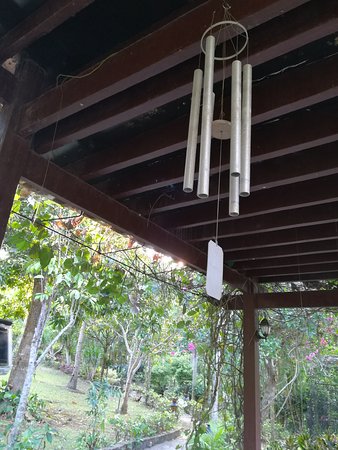
Locate an element on the screen. The width and height of the screenshot is (338, 450). windchime is located at coordinates (237, 48).